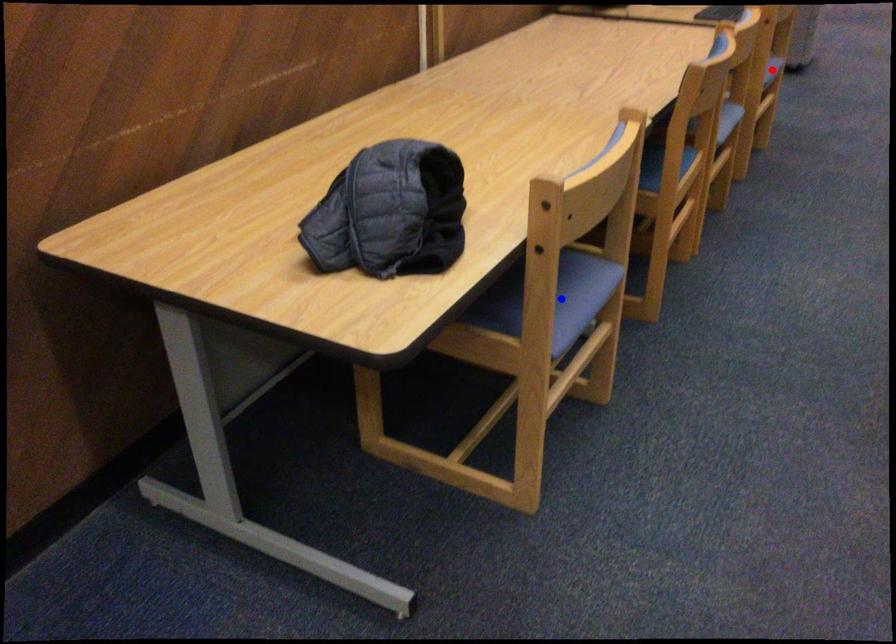
Question: Two points are marked on the image. Which point is closer to the camera?

Choices:
 (A) Blue point is closer.
 (B) Red point is closer.

Answer: (A)